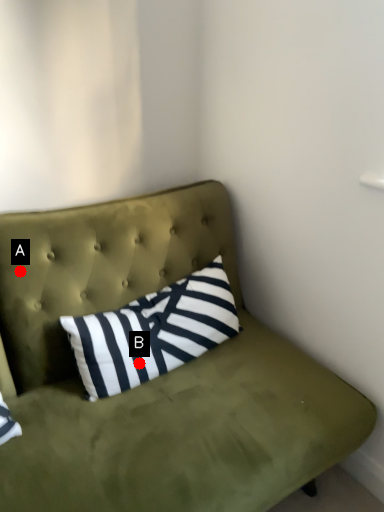
Question: Two points are circled on the image, labeled by A and B beside each circle. Which point is farther from the camera taking this photo?

Choices:
 (A) A is further
 (B) B is further

Answer: (B)